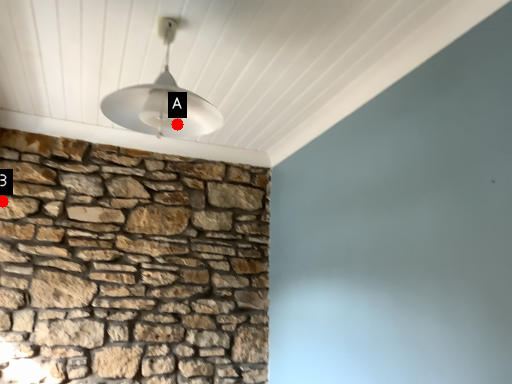
Question: Two points are circled on the image, labeled by A and B beside each circle. Which of the following is the farthest from the observer?

Choices:
 (A) A is further
 (B) B is further

Answer: (B)